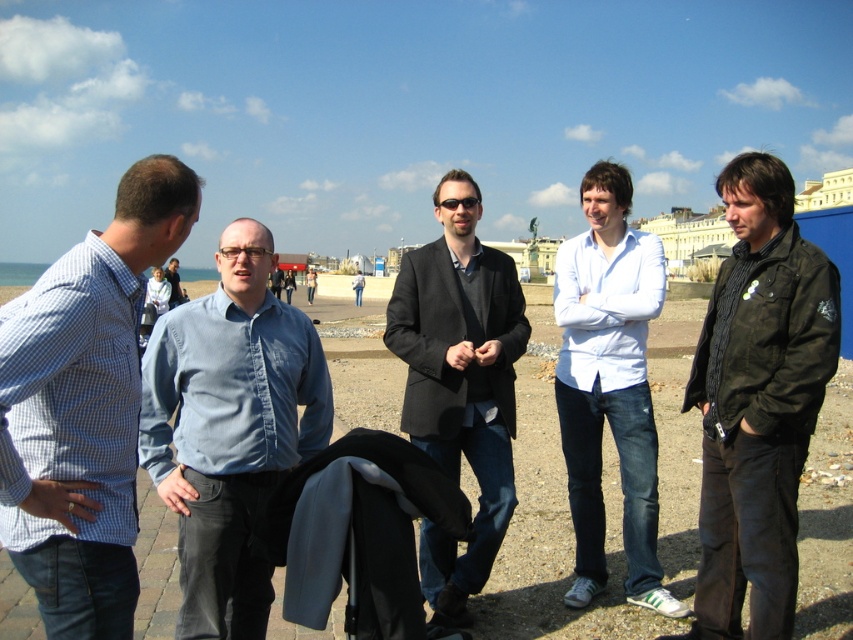
From the picture: You are standing on the paved area near the beach and want to walk to the smooth sand at center. However, there is a dark green leather jacket at right in your path. Which direction should you move to avoid the jacket and reach the sand?

To reach the smooth sand at center while avoiding the dark green leather jacket at right, move to the left since the sand is positioned to the left of the jacket.

Consider the image. You are standing at the beach and see two points marked in the image. Which point is closer to you, point (x=386, y=364) or point (x=479, y=508)?

Point (x=386, y=364) is further to the camera than point (x=479, y=508), so the closer point to you is point (x=479, y=508).